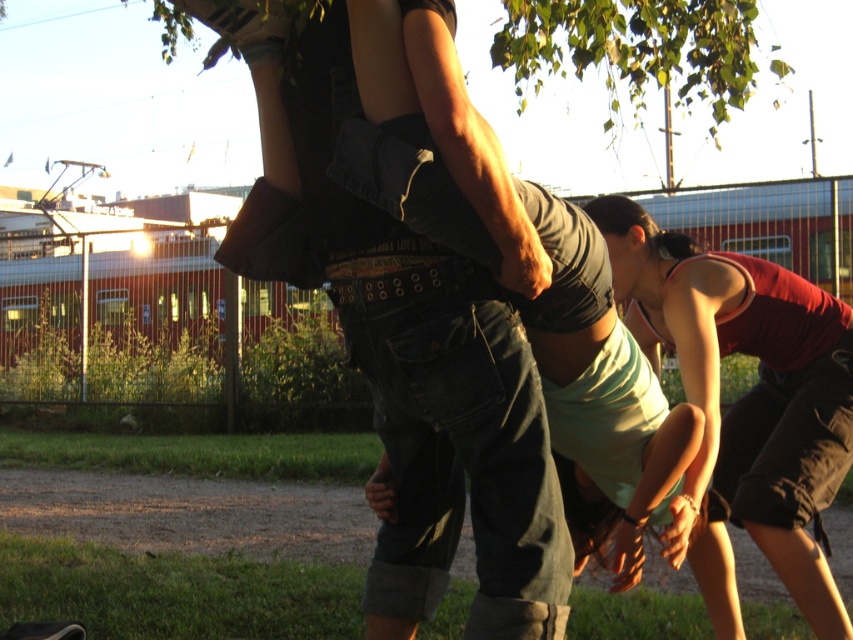
Is matte green tank top at lower right positioned behind green leafy tree at upper center?

No.

Who is lower down, matte green tank top at lower right or green leafy tree at upper center?

Positioned lower is matte green tank top at lower right.

Where is `matte green tank top at lower right`? matte green tank top at lower right is located at coordinates (744, 404).

This screenshot has height=640, width=853. Find the location of `matte green tank top at lower right`. matte green tank top at lower right is located at coordinates (744, 404).

From the picture: Who is taller, denim jeans at center or matte green tank top at lower right?

With more height is matte green tank top at lower right.

Is point (466, 358) more distant than point (718, 321)?

No, it is in front of (718, 321).

The height and width of the screenshot is (640, 853). What are the coordinates of `denim jeans at center` in the screenshot? It's located at (409, 362).

Is denim jeans at center thinner than green leafy tree at upper center?

Yes.

Can you confirm if denim jeans at center is wider than green leafy tree at upper center?

In fact, denim jeans at center might be narrower than green leafy tree at upper center.

Between point (410, 484) and point (692, 68), which one is positioned in front?

Positioned in front is point (410, 484).

This screenshot has width=853, height=640. What are the coordinates of `denim jeans at center` in the screenshot? It's located at (409, 362).